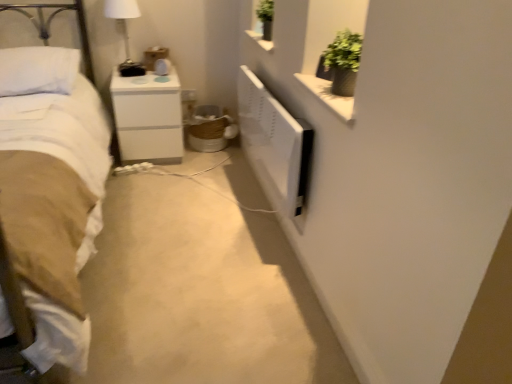
Question: Is white glossy nightstand at center thinner than white glossy lampshade at upper left?

Choices:
 (A) no
 (B) yes

Answer: (A)

Question: Can you confirm if white glossy nightstand at center is smaller than white glossy lampshade at upper left?

Choices:
 (A) no
 (B) yes

Answer: (A)

Question: From the image's perspective, is white glossy nightstand at center on white glossy lampshade at upper left?

Choices:
 (A) yes
 (B) no

Answer: (B)

Question: Considering the relative sizes of white glossy nightstand at center and white glossy lampshade at upper left in the image provided, is white glossy nightstand at center wider than white glossy lampshade at upper left?

Choices:
 (A) no
 (B) yes

Answer: (B)

Question: Does white glossy nightstand at center have a larger size compared to white glossy lampshade at upper left?

Choices:
 (A) no
 (B) yes

Answer: (B)

Question: Does point (61, 77) appear closer or farther from the camera than point (129, 3)?

Choices:
 (A) closer
 (B) farther

Answer: (A)

Question: Is white soft pillow at upper left bigger or smaller than white glossy lampshade at upper left?

Choices:
 (A) big
 (B) small

Answer: (A)

Question: From a real-world perspective, is white soft pillow at upper left positioned above or below white glossy lampshade at upper left?

Choices:
 (A) below
 (B) above

Answer: (A)

Question: Is white soft pillow at upper left to the left or to the right of white glossy lampshade at upper left in the image?

Choices:
 (A) left
 (B) right

Answer: (A)

Question: Considering their positions, is white soft pillow at upper left located in front of or behind white soft bed at left?

Choices:
 (A) front
 (B) behind

Answer: (B)

Question: In terms of width, does white soft pillow at upper left look wider or thinner when compared to white soft bed at left?

Choices:
 (A) wide
 (B) thin

Answer: (B)

Question: From a real-world perspective, is white soft pillow at upper left above or below white soft bed at left?

Choices:
 (A) above
 (B) below

Answer: (A)

Question: From the image's perspective, is white soft pillow at upper left above or below white soft bed at left?

Choices:
 (A) above
 (B) below

Answer: (A)

Question: Does point (31, 268) appear closer or farther from the camera than point (129, 61)?

Choices:
 (A) closer
 (B) farther

Answer: (A)

Question: Is white soft bed at left in front of or behind white glossy lampshade at upper left in the image?

Choices:
 (A) front
 (B) behind

Answer: (A)